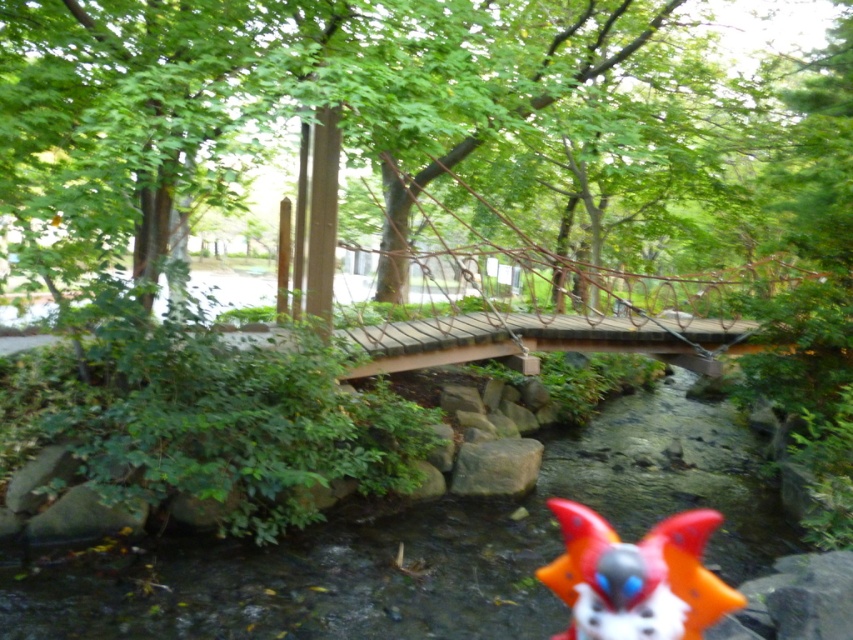
Between smooth stone creek at center and gray rough rock at center, which one appears on the right side from the viewer's perspective?

smooth stone creek at center

Who is taller, smooth stone creek at center or gray rough rock at center?

smooth stone creek at center is taller.

The width and height of the screenshot is (853, 640). I want to click on smooth stone creek at center, so click(x=425, y=547).

Image resolution: width=853 pixels, height=640 pixels. What do you see at coordinates (425, 547) in the screenshot?
I see `smooth stone creek at center` at bounding box center [425, 547].

Identify the location of smooth stone creek at center. (425, 547).

Is point (660, 628) positioned after point (508, 484)?

No.

Between point (723, 592) and point (511, 467), which one is positioned behind?

Point (511, 467)

This screenshot has height=640, width=853. Find the location of `orange matte toy at lower right`. orange matte toy at lower right is located at coordinates (636, 577).